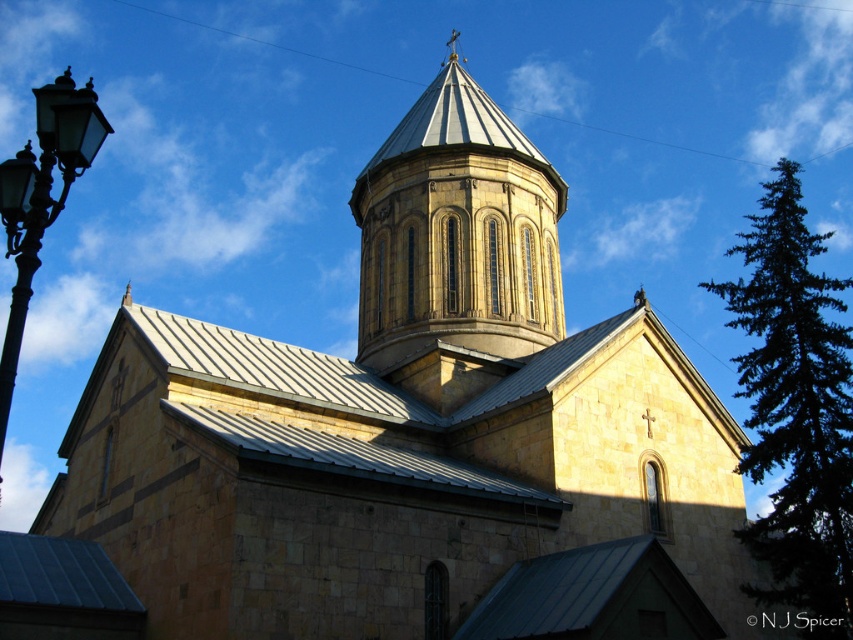
You are a GUI agent. You are given a task and a screenshot of the screen. Output one action in this format:
    pyautogui.click(x=<x>, y=<y>)
    Task: Click on the golden stone tower at center
    This screenshot has width=853, height=640.
    Given the screenshot: What is the action you would take?
    pyautogui.click(x=457, y=230)

Can you confirm if golden stone tower at center is thinner than black glass streetlight at left?

Yes.

Describe the element at coordinates (457, 230) in the screenshot. This screenshot has width=853, height=640. I see `golden stone tower at center` at that location.

Locate an element on the screen. The width and height of the screenshot is (853, 640). golden stone tower at center is located at coordinates (457, 230).

Describe the element at coordinates (795, 410) in the screenshot. The height and width of the screenshot is (640, 853). I see `dark green coniferous tree at right` at that location.

Can you confirm if dark green coniferous tree at right is taller than black glass streetlight at left?

No, dark green coniferous tree at right is not taller than black glass streetlight at left.

Where is `dark green coniferous tree at right`? The width and height of the screenshot is (853, 640). dark green coniferous tree at right is located at coordinates (795, 410).

Who is shorter, golden stone tower at center or dark green coniferous tree at right?

golden stone tower at center

Is golden stone tower at center shorter than dark green coniferous tree at right?

Indeed, golden stone tower at center has a lesser height compared to dark green coniferous tree at right.

Between point (445, 145) and point (793, 477), which one is positioned behind?

The point (445, 145) is more distant.

At what (x,y) coordinates should I click in order to perform the action: click on golden stone tower at center. Please return your answer as a coordinate pair (x, y). Image resolution: width=853 pixels, height=640 pixels. Looking at the image, I should click on (457, 230).